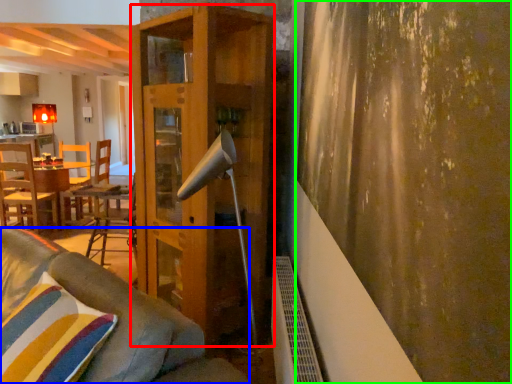
Question: Which object is positioned closest to shelf (highlighted by a red box)? Select from studio couch (highlighted by a blue box) and curtain (highlighted by a green box).

Choices:
 (A) studio couch
 (B) curtain

Answer: (A)